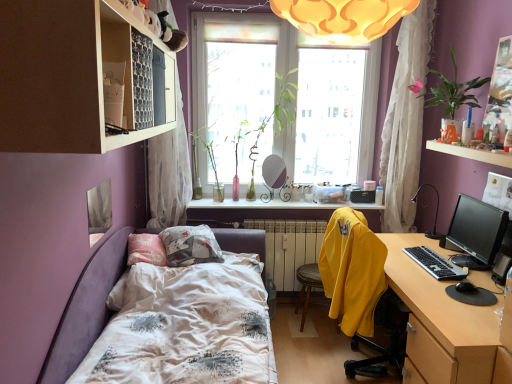
I want to click on free space between black plastic keyboard at right and black glossy monitor at right, so click(x=450, y=258).